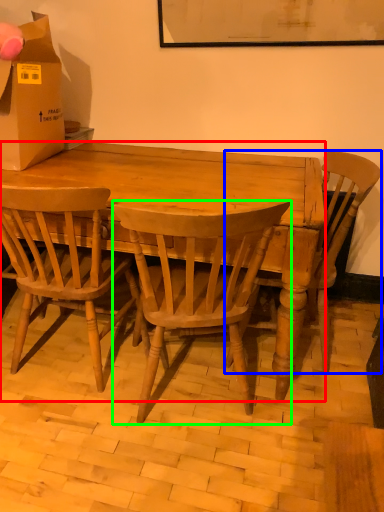
Question: Which object is the farthest from desk (highlighted by a red box)? Choose among these: chair (highlighted by a blue box) or chair (highlighted by a green box).

Choices:
 (A) chair
 (B) chair

Answer: (A)